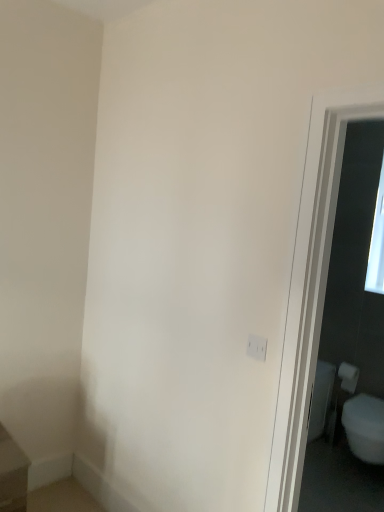
Measure the distance between point (x=345, y=371) and camera.

A distance of 3.17 meters exists between point (x=345, y=371) and camera.

Where is `white matte toilet paper at right`? Image resolution: width=384 pixels, height=512 pixels. white matte toilet paper at right is located at coordinates (348, 377).

Describe the element at coordinates (348, 377) in the screenshot. The image size is (384, 512). I see `white matte toilet paper at right` at that location.

Find the location of a particular element. white matte electric outlet at center-right is located at coordinates (257, 347).

What do you see at coordinates (257, 347) in the screenshot? The height and width of the screenshot is (512, 384). I see `white matte electric outlet at center-right` at bounding box center [257, 347].

Find the location of `white matte toilet paper at right`. white matte toilet paper at right is located at coordinates (348, 377).

Considering the positions of objects white matte electric outlet at center-right and white matte toilet paper at right in the image provided, who is more to the left, white matte electric outlet at center-right or white matte toilet paper at right?

Positioned to the left is white matte electric outlet at center-right.

Does white matte electric outlet at center-right lie behind white matte toilet paper at right?

No.

Which is closer to the camera, (248, 352) or (356, 370)?

Clearly, point (248, 352) is closer to the camera than point (356, 370).

From the image's perspective, is white matte electric outlet at center-right located beneath white matte toilet paper at right?

No.

From a real-world perspective, is white matte electric outlet at center-right positioned under white matte toilet paper at right based on gravity?

No.

Considering the sizes of objects white matte electric outlet at center-right and white matte toilet paper at right in the image provided, who is thinner, white matte electric outlet at center-right or white matte toilet paper at right?

Thinner between the two is white matte electric outlet at center-right.

Considering the relative sizes of white matte electric outlet at center-right and white matte toilet paper at right in the image provided, is white matte electric outlet at center-right shorter than white matte toilet paper at right?

Correct, white matte electric outlet at center-right is not as tall as white matte toilet paper at right.

Is white matte electric outlet at center-right bigger or smaller than white matte toilet paper at right?

Considering their sizes, white matte electric outlet at center-right takes up less space than white matte toilet paper at right.

Can white matte toilet paper at right be found inside white matte electric outlet at center-right?

Actually, white matte toilet paper at right is outside white matte electric outlet at center-right.

Would you consider white matte electric outlet at center-right to be distant from white matte toilet paper at right?

Yes, white matte electric outlet at center-right and white matte toilet paper at right are located far from each other.

Could you tell me if white matte electric outlet at center-right is turned towards white matte toilet paper at right?

No, white matte electric outlet at center-right is not facing towards white matte toilet paper at right.

Can you tell me how much white matte electric outlet at center-right and white matte toilet paper at right differ in facing direction?

The angular difference between white matte electric outlet at center-right and white matte toilet paper at right is 1.24 degrees.

In order to click on electric outlet above the white matte toilet paper at right (from the image's perspective) in this screenshot , I will do `click(257, 347)`.

Does white matte toilet paper at right appear on the left side of white matte electric outlet at center-right?

Incorrect, white matte toilet paper at right is not on the left side of white matte electric outlet at center-right.

Considering the positions of objects white matte toilet paper at right and white matte electric outlet at center-right in the image provided, who is in front, white matte toilet paper at right or white matte electric outlet at center-right?

white matte electric outlet at center-right is closer to the camera.

Does point (342, 362) appear closer or farther from the camera than point (257, 339)?

Point (342, 362) is positioned farther from the camera compared to point (257, 339).

Looking at this image, from the image's perspective, between white matte toilet paper at right and white matte electric outlet at center-right, which one is located above?

white matte electric outlet at center-right appears higher in the image.

Consider the image. From a real-world perspective, is white matte toilet paper at right positioned over white matte electric outlet at center-right based on gravity?

No, from a real-world perspective, white matte toilet paper at right is not on top of white matte electric outlet at center-right.

Which of these two, white matte toilet paper at right or white matte electric outlet at center-right, is wider?

Wider between the two is white matte toilet paper at right.

Can you confirm if white matte toilet paper at right is taller than white matte electric outlet at center-right?

Indeed, white matte toilet paper at right has a greater height compared to white matte electric outlet at center-right.

Looking at the image, does white matte toilet paper at right seem bigger or smaller compared to white matte electric outlet at center-right?

Considering their sizes, white matte toilet paper at right takes up more space than white matte electric outlet at center-right.

Is white matte toilet paper at right surrounding white matte electric outlet at center-right?

No, white matte toilet paper at right does not contain white matte electric outlet at center-right.

Is white matte toilet paper at right far from white matte electric outlet at center-right?

That's right, there is a large distance between white matte toilet paper at right and white matte electric outlet at center-right.

Is white matte toilet paper at right aimed at white matte electric outlet at center-right?

Yes, white matte toilet paper at right is facing white matte electric outlet at center-right.

Locate an element on the screen. The height and width of the screenshot is (512, 384). electric outlet lying on the left of white matte toilet paper at right is located at coordinates (257, 347).

The height and width of the screenshot is (512, 384). I want to click on toilet paper that appears below the white matte electric outlet at center-right (from the image's perspective), so click(x=348, y=377).

The image size is (384, 512). What are the coordinates of `toilet paper below the white matte electric outlet at center-right (from a real-world perspective)` in the screenshot? It's located at (348, 377).